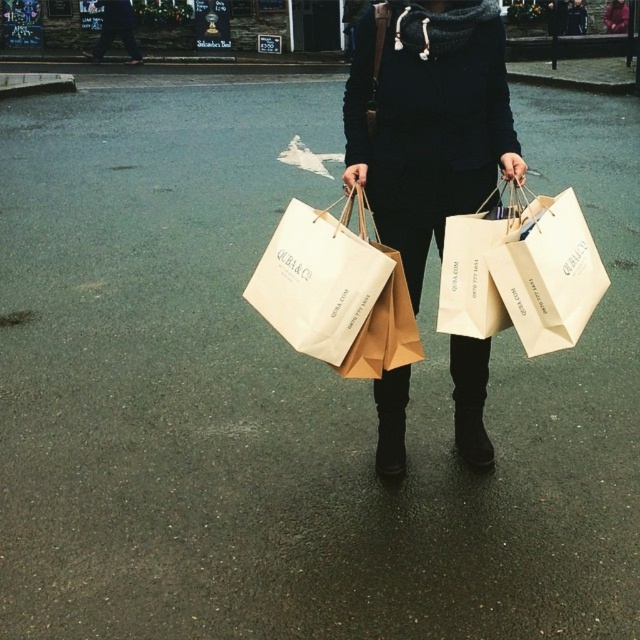
Does matte paper shopping bags at center have a smaller size compared to black suede boot at center?

No, matte paper shopping bags at center is not smaller than black suede boot at center.

Does matte paper shopping bags at center appear on the left side of black suede boot at center?

No, matte paper shopping bags at center is not to the left of black suede boot at center.

Which is in front, point (496, 17) or point (401, 426)?

Positioned in front is point (496, 17).

Where is `matte paper shopping bags at center`? The image size is (640, 640). matte paper shopping bags at center is located at coordinates (428, 120).

Is matte paper shopping bags at center wider than matte white paper bag at center?

Correct, the width of matte paper shopping bags at center exceeds that of matte white paper bag at center.

Is point (499, 106) positioned behind point (381, 369)?

Yes, point (499, 106) is behind point (381, 369).

Locate an element on the screen. matte paper shopping bags at center is located at coordinates (428, 120).

How much distance is there between matte white paper bag at center and white paper bag at center?

matte white paper bag at center is 19.30 inches away from white paper bag at center.

Does point (310, 241) lie in front of point (490, 273)?

No, (310, 241) is further to viewer.

Describe the element at coordinates (336, 291) in the screenshot. I see `matte white paper bag at center` at that location.

Identify the location of matte white paper bag at center. (336, 291).